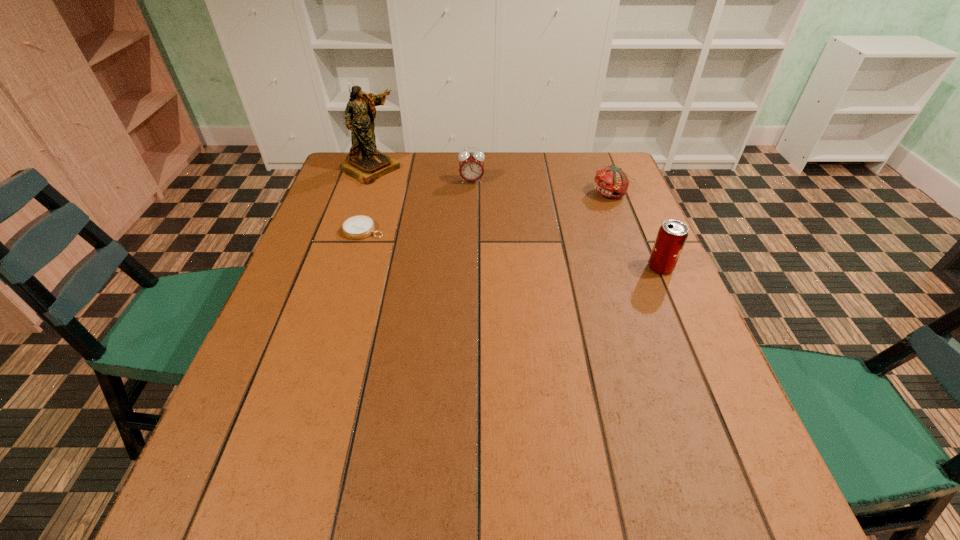
The image size is (960, 540). What are the coordinates of `the shortest object` in the screenshot? It's located at (358, 227).

The height and width of the screenshot is (540, 960). In order to click on the fourth farthest object in this screenshot , I will do `click(358, 227)`.

Identify the location of beer can. (672, 235).

I want to click on the third object from right to left, so click(x=471, y=167).

Where is `tomato`? The height and width of the screenshot is (540, 960). tomato is located at coordinates (612, 182).

This screenshot has width=960, height=540. What are the coordinates of `the tallest object` in the screenshot? It's located at (366, 164).

Find the location of `vacant area located 0.230m on the front of the compass`. vacant area located 0.230m on the front of the compass is located at coordinates (341, 306).

At what (x,y) coordinates should I click in order to perform the action: click on free spot located on the left of the nearest object. Please return your answer as a coordinate pair (x, y). Looking at the image, I should click on (593, 268).

Where is `free spot located 0.260m on the clock face of the third object from right to left`? This screenshot has height=540, width=960. free spot located 0.260m on the clock face of the third object from right to left is located at coordinates (471, 239).

The width and height of the screenshot is (960, 540). I want to click on free location located on the clock face of the third object from right to left, so click(471, 255).